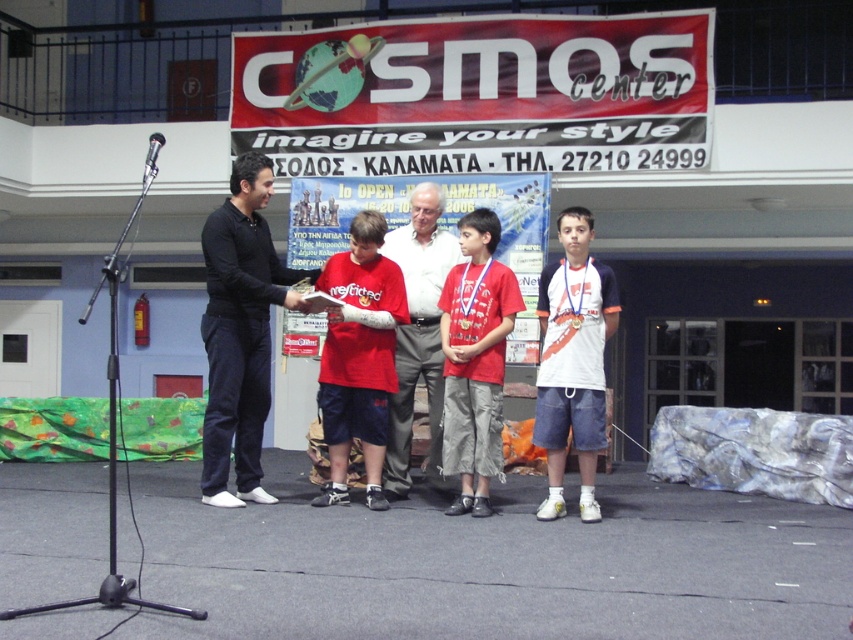
Can you confirm if black matte shirt at left is wider than red cotton shirt at center?

Yes.

Who is higher up, black matte shirt at left or red cotton shirt at center?

black matte shirt at left is higher up.

What are the coordinates of `black matte shirt at left` in the screenshot? It's located at (239, 332).

Is black matte shirt at left wider than white cotton t-shirt at center?

Yes, black matte shirt at left is wider than white cotton t-shirt at center.

Is black matte shirt at left in front of white cotton t-shirt at center?

No, black matte shirt at left is behind white cotton t-shirt at center.

Identify the location of black matte shirt at left. (239, 332).

From the picture: Does red matte shirt at center appear under metallic silver microphone at upper left?

Yes.

Which is above, red matte shirt at center or metallic silver microphone at upper left?

metallic silver microphone at upper left

Is point (370, 442) farther from viewer compared to point (155, 134)?

Yes, point (370, 442) is behind point (155, 134).

This screenshot has width=853, height=640. Identify the location of red matte shirt at center. 358,356.